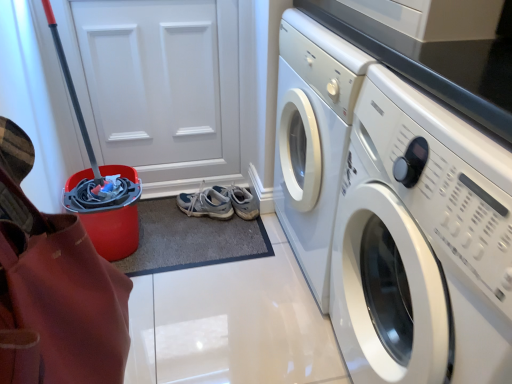
Question: Does red plastic bucket at left come in front of light gray fabric running shoe at center?

Choices:
 (A) yes
 (B) no

Answer: (A)

Question: Is red plastic bucket at left positioned with its back to light gray fabric running shoe at center?

Choices:
 (A) yes
 (B) no

Answer: (B)

Question: Does red plastic bucket at left come behind light gray fabric running shoe at center?

Choices:
 (A) yes
 (B) no

Answer: (B)

Question: Can you confirm if red plastic bucket at left is thinner than light gray fabric running shoe at center?

Choices:
 (A) yes
 (B) no

Answer: (A)

Question: Does red plastic bucket at left have a smaller size compared to light gray fabric running shoe at center?

Choices:
 (A) no
 (B) yes

Answer: (A)

Question: From a real-world perspective, is light gray fabric running shoe at center above or below white matte door at upper left?

Choices:
 (A) below
 (B) above

Answer: (A)

Question: Based on their positions, is light gray fabric running shoe at center located to the left or right of white matte door at upper left?

Choices:
 (A) right
 (B) left

Answer: (A)

Question: Is light gray fabric running shoe at center in front of or behind white matte door at upper left in the image?

Choices:
 (A) behind
 (B) front

Answer: (A)

Question: Is point (184, 203) closer or farther from the camera than point (227, 66)?

Choices:
 (A) closer
 (B) farther

Answer: (B)

Question: Is red plastic bucket at left wider or thinner than white glossy washing machine at right?

Choices:
 (A) wide
 (B) thin

Answer: (B)

Question: From a real-world perspective, relative to white glossy washing machine at right, is red plastic bucket at left vertically above or below?

Choices:
 (A) above
 (B) below

Answer: (A)

Question: Choose the correct answer: Is red plastic bucket at left inside white glossy washing machine at right or outside it?

Choices:
 (A) inside
 (B) outside

Answer: (B)

Question: Relative to white glossy washing machine at right, is red plastic bucket at left in front or behind?

Choices:
 (A) behind
 (B) front

Answer: (B)

Question: Is white glossy washing machine at right in front of or behind red plastic bucket at left in the image?

Choices:
 (A) front
 (B) behind

Answer: (B)

Question: Is white glossy washing machine at right situated inside red plastic bucket at left or outside?

Choices:
 (A) inside
 (B) outside

Answer: (B)